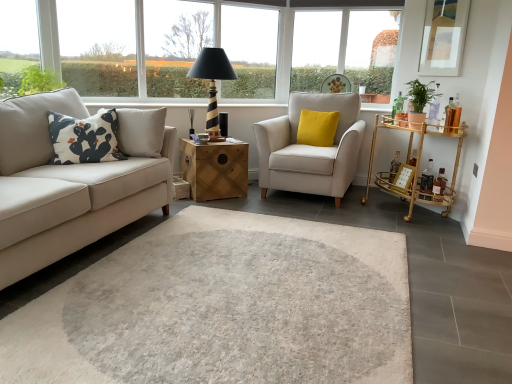
Question: Is transparent glass window at upper left, which appears as the first window when viewed from the left, in contact with yellow velvet cushion at center, the first pillow positioned from the back?

Choices:
 (A) yes
 (B) no

Answer: (B)

Question: Is transparent glass window at upper left, which appears as the first window when viewed from the left, behind yellow velvet cushion at center, arranged as the 2th pillow when viewed from the front?

Choices:
 (A) yes
 (B) no

Answer: (B)

Question: Does transparent glass window at upper left, arranged as the 1th window when viewed from the front, have a greater height compared to yellow velvet cushion at center, the first pillow positioned from the back?

Choices:
 (A) yes
 (B) no

Answer: (A)

Question: Would you say transparent glass window at upper left, which appears as the 2th window when viewed from the back, is outside yellow velvet cushion at center, the first pillow positioned from the back?

Choices:
 (A) yes
 (B) no

Answer: (A)

Question: Is transparent glass window at upper left, which appears as the 2th window when viewed from the back, smaller than yellow velvet cushion at center, arranged as the 2th pillow when viewed from the front?

Choices:
 (A) no
 (B) yes

Answer: (B)

Question: Considering the positions of transparent glass window at upper center, which is the second window from left to right, and beige fabric armchair at center in the image, is transparent glass window at upper center, which is the second window from left to right, taller or shorter than beige fabric armchair at center?

Choices:
 (A) tall
 (B) short

Answer: (A)

Question: Is transparent glass window at upper center, the second window from the front, inside the boundaries of beige fabric armchair at center, or outside?

Choices:
 (A) inside
 (B) outside

Answer: (B)

Question: From a real-world perspective, is transparent glass window at upper center, the 1th window positioned from the right, physically located above or below beige fabric armchair at center?

Choices:
 (A) below
 (B) above

Answer: (B)

Question: Does point (153, 67) appear closer or farther from the camera than point (349, 168)?

Choices:
 (A) farther
 (B) closer

Answer: (A)

Question: Is point (189, 21) closer or farther from the camera than point (5, 94)?

Choices:
 (A) farther
 (B) closer

Answer: (A)

Question: From the image's perspective, is transparent glass window at upper center, which is the second window from left to right, located above or below transparent glass window at upper left, arranged as the 1th window when viewed from the front?

Choices:
 (A) above
 (B) below

Answer: (A)

Question: Relative to transparent glass window at upper left, the second window in the right-to-left sequence, is transparent glass window at upper center, the second window from the front, in front or behind?

Choices:
 (A) behind
 (B) front

Answer: (A)

Question: In terms of size, does transparent glass window at upper center, the 1th window positioned from the right, appear bigger or smaller than transparent glass window at upper left, the second window in the right-to-left sequence?

Choices:
 (A) small
 (B) big

Answer: (B)

Question: Is black striped wood table lamp at upper center inside or outside of transparent glass window at upper left, the first window frame from the left?

Choices:
 (A) inside
 (B) outside

Answer: (B)

Question: Visually, is black striped wood table lamp at upper center positioned to the left or to the right of transparent glass window at upper left, the 2th window frame when ordered from right to left?

Choices:
 (A) right
 (B) left

Answer: (A)